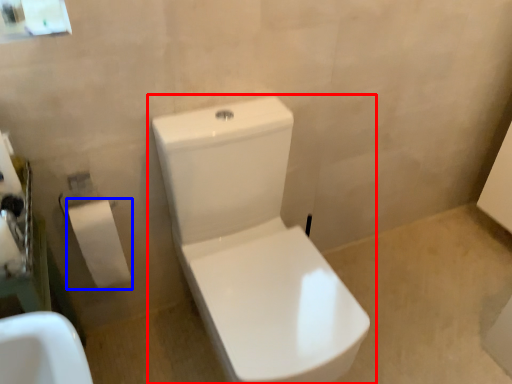
Question: Among these objects, which one is nearest to the camera, toilet (highlighted by a red box) or toiletry (highlighted by a blue box)?

Choices:
 (A) toilet
 (B) toiletry

Answer: (A)